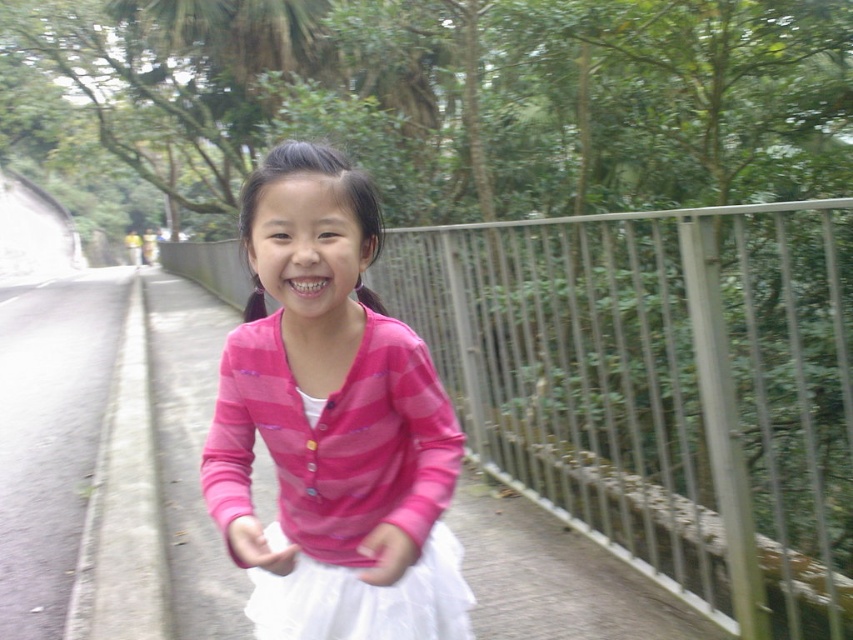
The girl is holding a pink striped sweater at center and standing near a metallic gray rail at center. Which object is taller?

The metallic gray rail at center is taller than the pink striped sweater at center.

Based on the photo, you are a drone operator trying to capture a photo of the young girl standing on the pathway. The metallic gray rail at center is in your camera frame. Where should you position the rail in your camera grid to ensure the girl is centered? Please provide coordinates in the format of a point like this example format of a point like this example format of a point like this example format of a point like this example format of a point like this example format of a point like this example format of a point like

The metallic gray rail at center is located at point (660, 388). To center the girl, position the rail at those coordinates in your camera grid.

The girl is holding a pink striped sweater at center and standing near a metallic gray rail at center. Which object is closer to the viewer?

The metallic gray rail at center is closer to the viewer than the pink striped sweater at center.